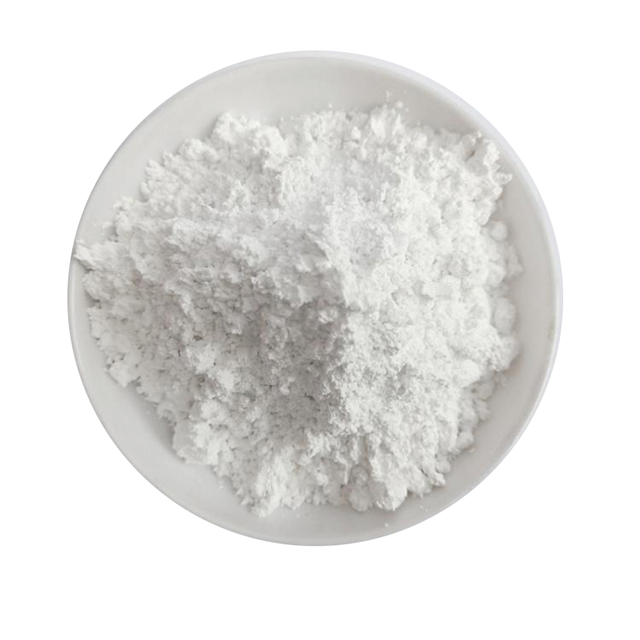
Find the location of a particular element. left side rim of bowl is located at coordinates (70, 323).